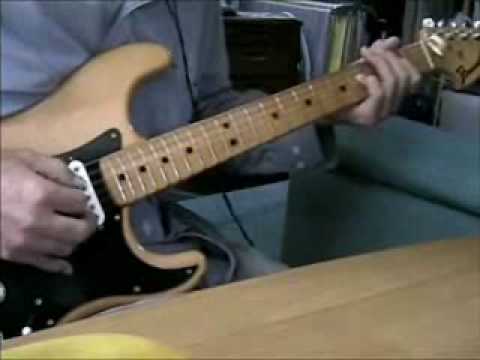
Find the location of a particular element. This screenshot has width=480, height=360. table is located at coordinates (285, 326).